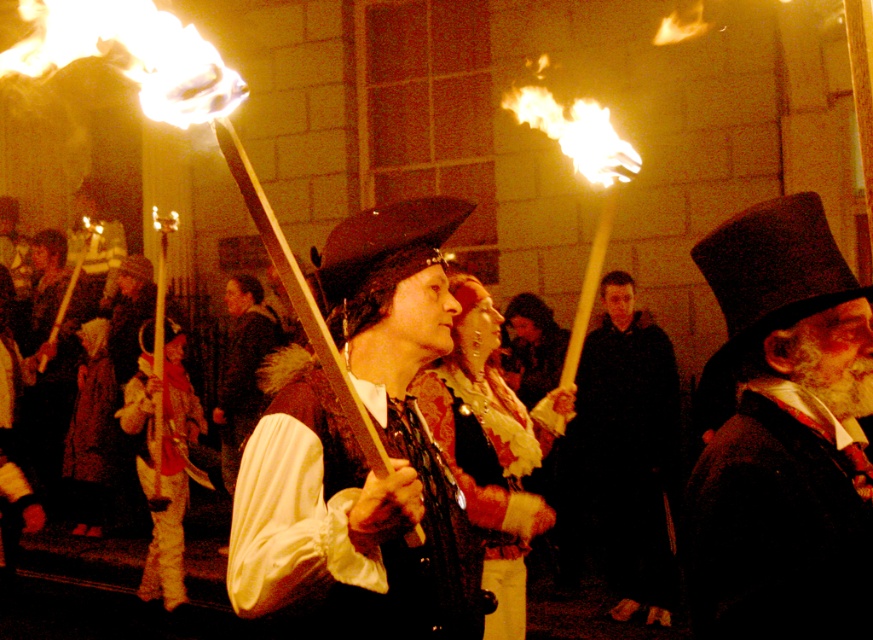
Who is more distant from viewer, [317,378] or [236,296]?

Point [236,296]

Which is in front, point (445, 237) or point (243, 435)?

Point (445, 237) is more forward.

Between point (417, 436) and point (246, 372), which one is positioned behind?

Positioned behind is point (246, 372).

Find the location of a particular element. The width and height of the screenshot is (873, 640). shiny black sword at center is located at coordinates (361, 452).

Can you confirm if dark matte coat at center is shorter than smooth brown coat at center?

In fact, dark matte coat at center may be taller than smooth brown coat at center.

Can you confirm if dark matte coat at center is thinner than smooth brown coat at center?

Correct, dark matte coat at center's width is less than smooth brown coat at center's.

Between point (610, 294) and point (238, 282), which one is positioned in front?

Positioned in front is point (610, 294).

I want to click on dark matte coat at center, so click(629, 448).

Does point (400, 225) lie behind point (740, 566)?

Yes, point (400, 225) is behind point (740, 566).

Is shiny black sword at center above dark woolen top hat at right?

Actually, shiny black sword at center is below dark woolen top hat at right.

Is point (354, 529) behind point (836, 552)?

No, (354, 529) is closer to viewer.

Where is `shiny black sword at center`? shiny black sword at center is located at coordinates [361, 452].